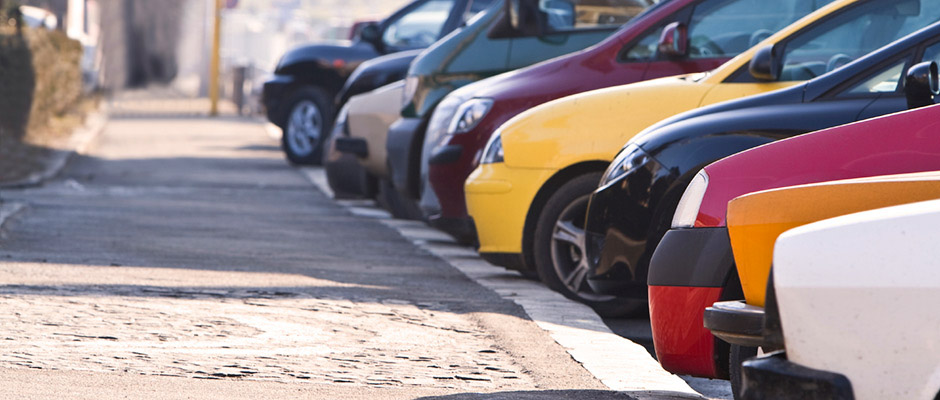
Where is `side windows`? The height and width of the screenshot is (400, 940). side windows is located at coordinates (872, 32), (932, 51), (734, 27), (605, 11), (429, 16).